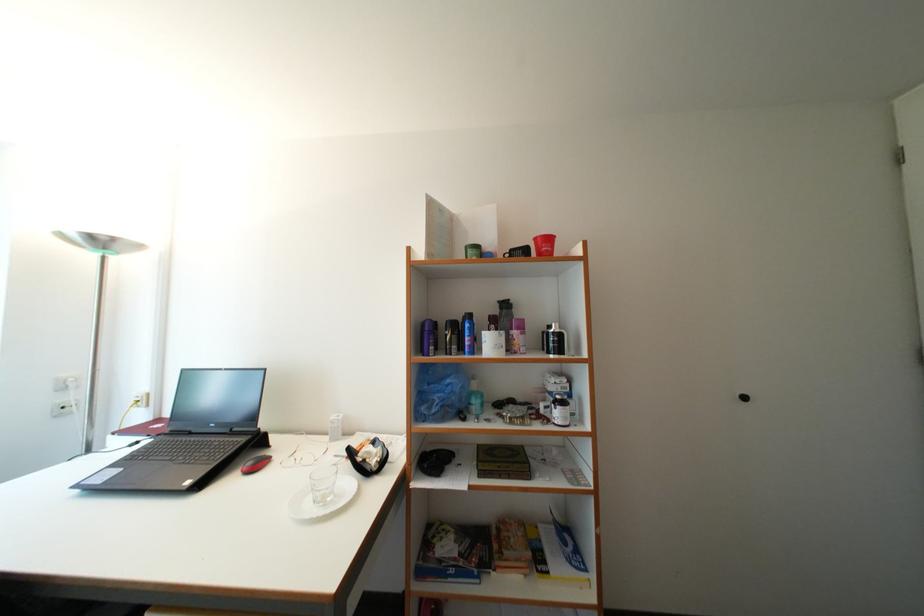
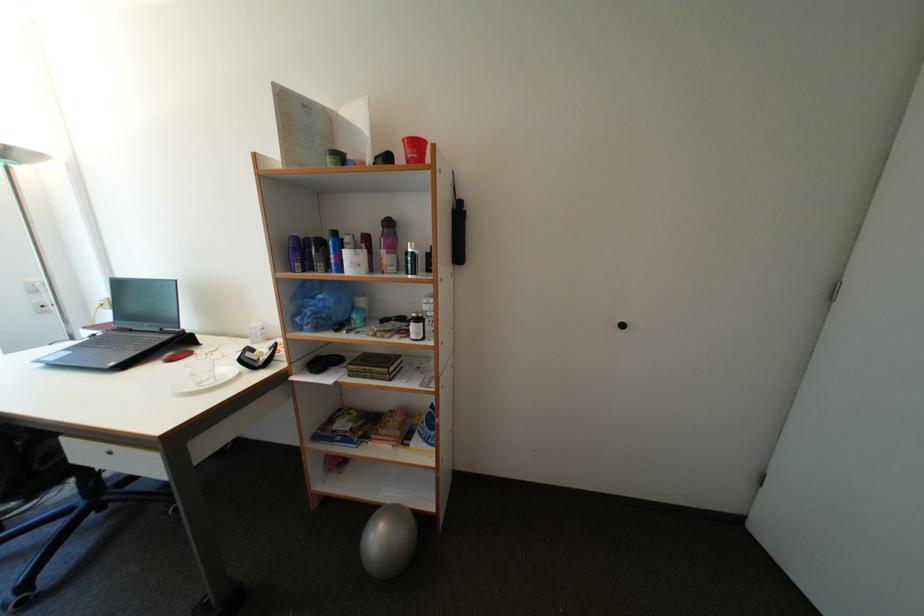
Question: How did the camera likely rotate?

Choices:
 (A) Left
 (B) Right
 (C) Up
 (D) Down

Answer: (D)